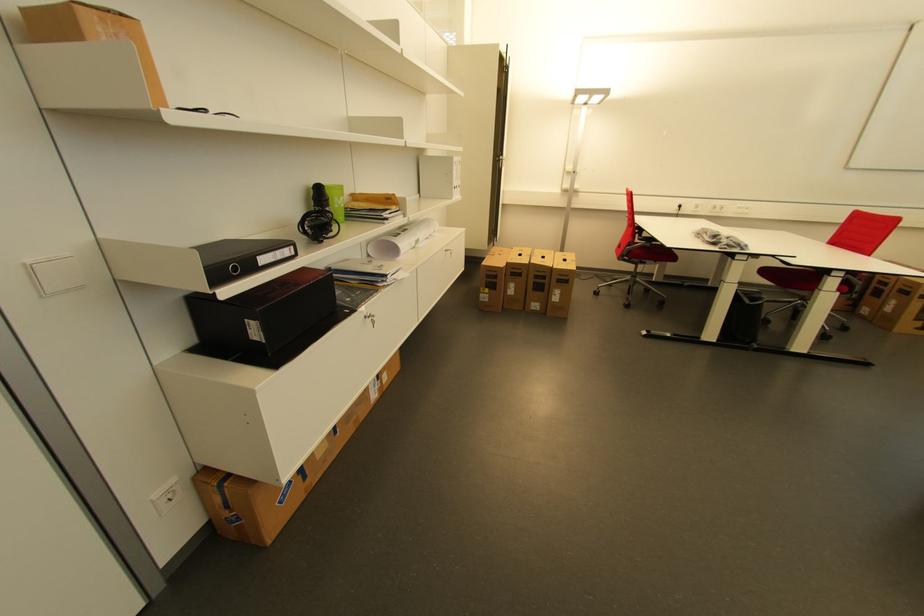
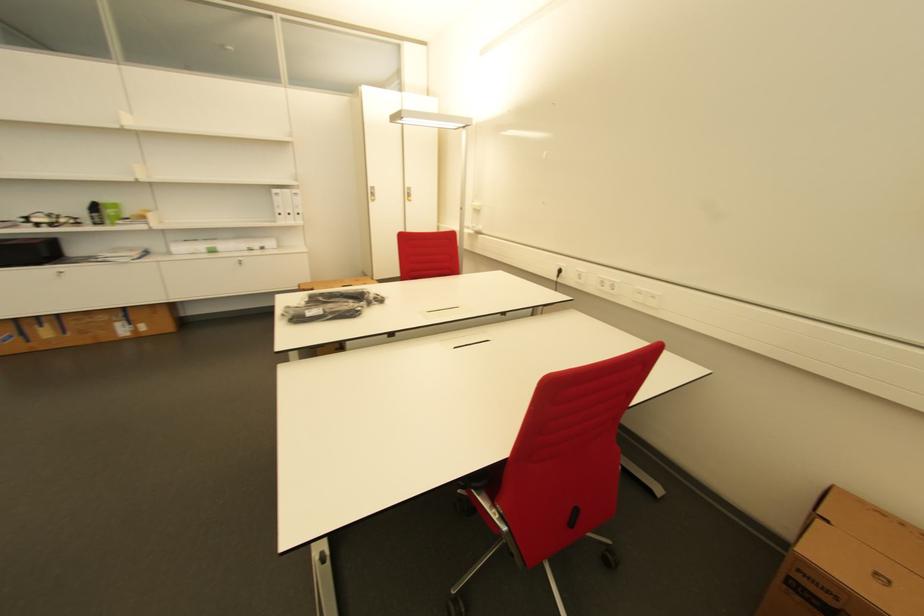
Find the pixel in the second image that matches pixel 723 211 in the first image.

(612, 289)